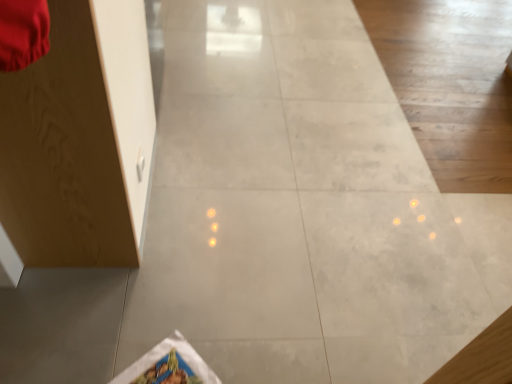
I want to click on blank space situated above white glossy wrapping paper at lower center (from a real-world perspective), so click(x=160, y=362).